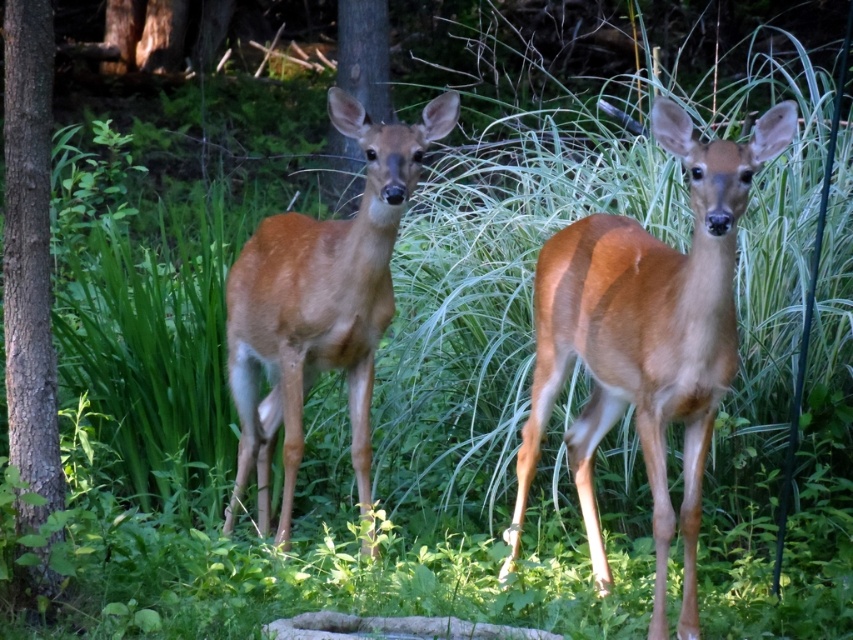
You are a photographer aiming to capture a closeup of the brown fur deer at center without the brown rough bark tree at left blocking the view. Based on their positions, can you position yourself in a way to avoid the tree?

The brown fur deer at center is below the brown rough bark tree at left, so positioning yourself lower or moving to the side might allow you to capture the deer without the tree blocking the view.

You are a hiker who just found a trail marker at point (28, 259). What object is located at that point?

The point (28, 259) corresponds to the brown rough bark tree at left.

You are a wildlife photographer carrying a tripod that requires a 5 meter distance to set up between two trees. You see the brown rough bark tree at left and the brown wood tree at center. Can you set up your tripod between them?

The distance between the brown rough bark tree at left and the brown wood tree at center is 4.86 meters, which is slightly less than the required 5 meters. Therefore, you cannot set up your tripod between them as there isn